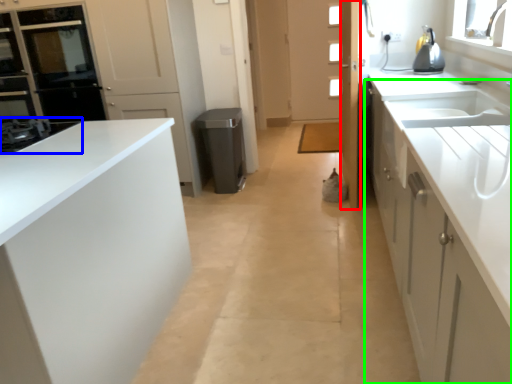
Question: Estimate the real-world distances between objects in this image. Which object is closer to door (highlighted by a red box), home appliance (highlighted by a blue box) or cabinetry (highlighted by a green box)?

Choices:
 (A) home appliance
 (B) cabinetry

Answer: (B)